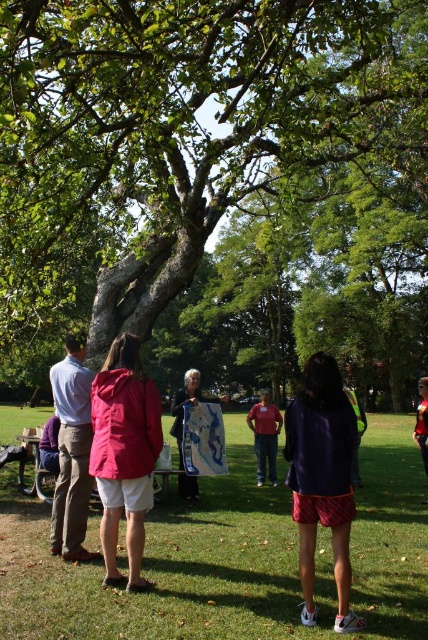
Question: Which object appears closest to the camera in this image?

Choices:
 (A) wooden park bench at lower left
 (B) red fabric jacket at center
 (C) light blue shirt at left

Answer: (C)

Question: Does green grass at center have a larger size compared to matte blue map at center?

Choices:
 (A) yes
 (B) no

Answer: (B)

Question: Does green rough bark tree at center appear on the right side of dark blue jacket at center?

Choices:
 (A) no
 (B) yes

Answer: (A)

Question: Which object is the closest to the red fabric jacket at center?

Choices:
 (A) light blue shirt at left
 (B) green rough bark tree at center
 (C) matte pink jacket at center
 (D) green grass at center

Answer: (D)

Question: Estimate the real-world distances between objects in this image. Which object is farther from the green rough bark tree at center?

Choices:
 (A) matte blue map at center
 (B) dark blue jacket at center
 (C) matte pink jacket at center

Answer: (B)

Question: Does matte pink jacket at center appear on the left side of neon green jacket at center?

Choices:
 (A) yes
 (B) no

Answer: (A)